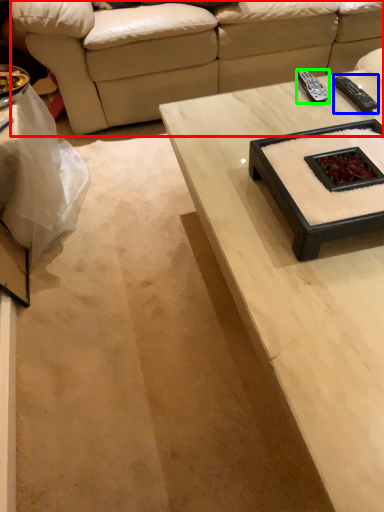
Question: Which object is the farthest from studio couch (highlighted by a red box)? Choose among these: remote (highlighted by a blue box) or remote (highlighted by a green box).

Choices:
 (A) remote
 (B) remote

Answer: (A)